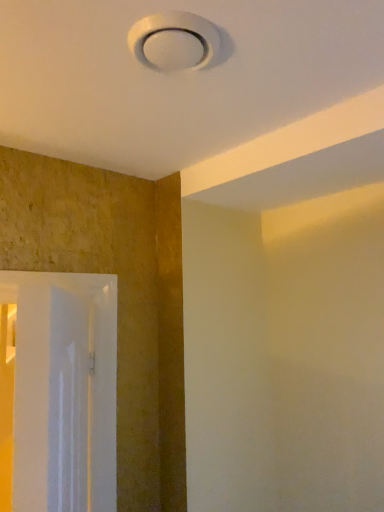
Question: From the image's perspective, relative to white plastic lamp at upper center, is white glossy door at left above or below?

Choices:
 (A) above
 (B) below

Answer: (B)

Question: In the image, is white glossy door at left positioned in front of or behind white plastic lamp at upper center?

Choices:
 (A) front
 (B) behind

Answer: (B)

Question: From their relative heights in the image, would you say white glossy door at left is taller or shorter than white plastic lamp at upper center?

Choices:
 (A) tall
 (B) short

Answer: (A)

Question: From a real-world perspective, is white plastic lamp at upper center positioned above or below white glossy door at left?

Choices:
 (A) below
 (B) above

Answer: (B)

Question: Does point (182, 31) appear closer or farther from the camera than point (102, 402)?

Choices:
 (A) farther
 (B) closer

Answer: (B)

Question: Is white plastic lamp at upper center wider or thinner than white glossy door at left?

Choices:
 (A) wide
 (B) thin

Answer: (A)

Question: In terms of size, does white plastic lamp at upper center appear bigger or smaller than white glossy door at left?

Choices:
 (A) big
 (B) small

Answer: (B)